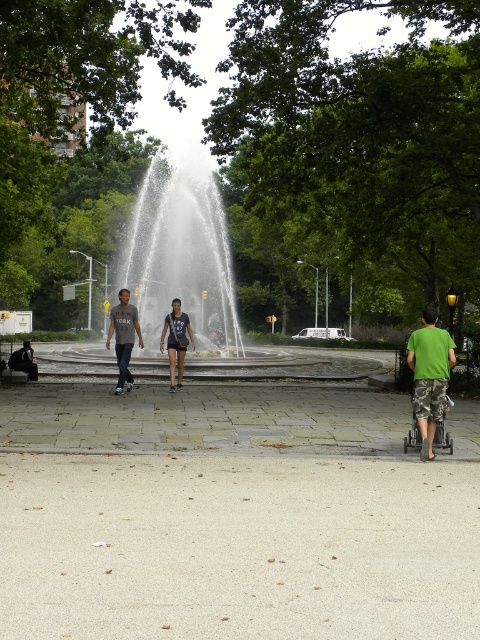
Question: Does green camouflage pants at right have a larger size compared to gray cotton t-shirt at left?

Choices:
 (A) yes
 (B) no

Answer: (B)

Question: Which is farther from the gray cotton t-shirt at left?

Choices:
 (A) matte black shorts at center
 (B) green camouflage pants at right
 (C) matte gray t-shirt at center

Answer: (B)

Question: Considering the real-world distances, which object is closest to the green camouflage pants at right?

Choices:
 (A) matte gray t-shirt at center
 (B) gray cotton t-shirt at left
 (C) matte black shorts at center

Answer: (A)

Question: Which point is closer to the camera?

Choices:
 (A) (120, 324)
 (B) (126, 305)

Answer: (A)

Question: Can you confirm if gray cotton t-shirt at left is positioned above matte black shorts at center?

Choices:
 (A) no
 (B) yes

Answer: (B)

Question: Is green camouflage pants at right further to the viewer compared to matte gray t-shirt at center?

Choices:
 (A) yes
 (B) no

Answer: (B)